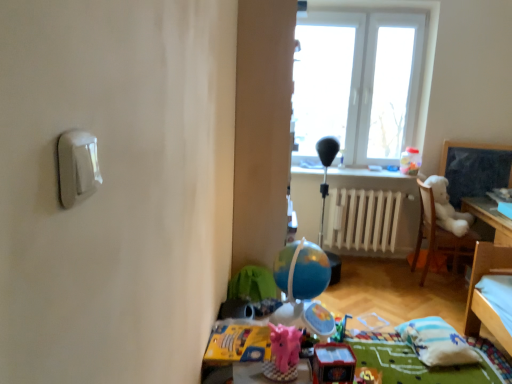
The width and height of the screenshot is (512, 384). In order to click on vacant region above white plastic window at upper center (from a real-world perspective) in this screenshot , I will do `click(366, 3)`.